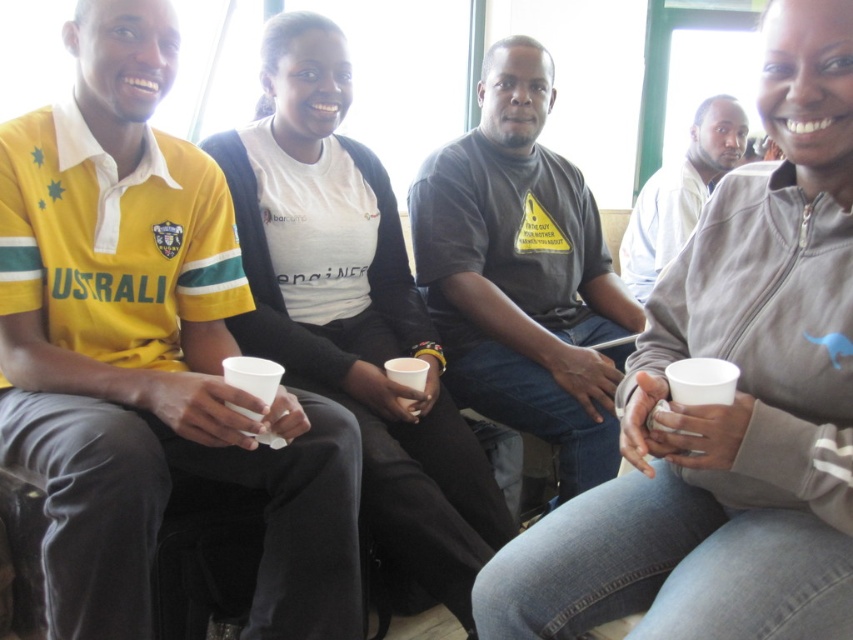
Who is more forward, [553,291] or [670,196]?

Point [553,291]

Who is higher up, dark gray t-shirt at center or white matte shirt at center?

white matte shirt at center is higher up.

Does point (471, 401) come farther from viewer compared to point (699, 122)?

No, it is not.

Find the location of a particular element. The width and height of the screenshot is (853, 640). dark gray t-shirt at center is located at coordinates (521, 273).

Based on the photo, does yellow jersey at upper left have a larger size compared to white matte shirt at center?

Yes, yellow jersey at upper left is bigger than white matte shirt at center.

Does point (344, 589) lie behind point (692, 186)?

No, it is in front of (692, 186).

Measure the distance between point [138,632] and camera.

Point [138,632] and camera are 4.06 feet apart.

Where is `yellow jersey at upper left`? The image size is (853, 640). yellow jersey at upper left is located at coordinates (148, 353).

Does yellow jersey at upper left have a lesser width compared to dark gray t-shirt at center?

No.

Can you confirm if yellow jersey at upper left is shorter than dark gray t-shirt at center?

Indeed, yellow jersey at upper left has a lesser height compared to dark gray t-shirt at center.

You are a GUI agent. You are given a task and a screenshot of the screen. Output one action in this format:
    pyautogui.click(x=<x>, y=<y>)
    Task: Click on the yellow jersey at upper left
    This screenshot has width=853, height=640.
    Given the screenshot: What is the action you would take?
    pyautogui.click(x=148, y=353)